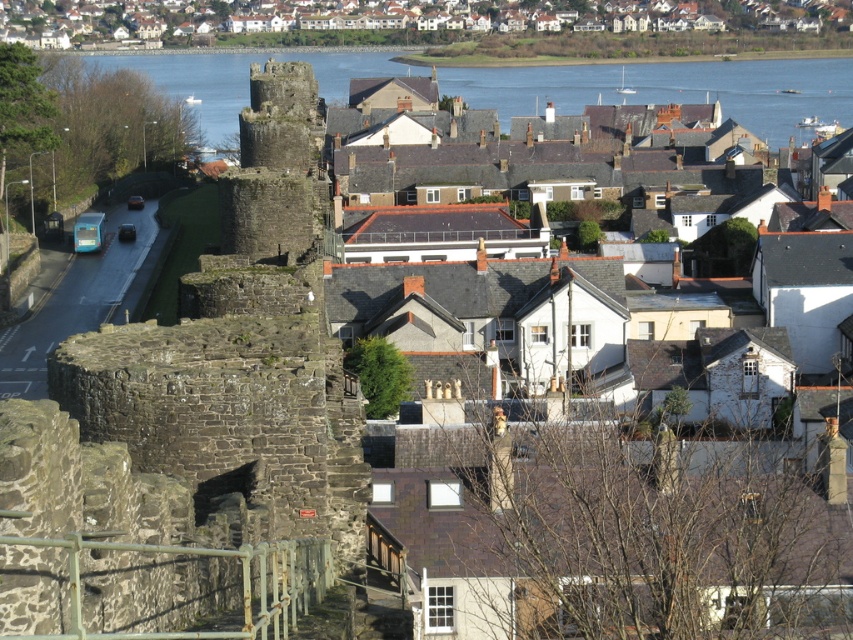
Can you confirm if rusty stone castle at center is taller than clear blue water at upper center?

No.

Who is more forward, (286, 513) or (827, 83)?

Point (286, 513)

Who is more forward, (224, 177) or (537, 81)?

Positioned in front is point (224, 177).

The image size is (853, 640). I want to click on rusty stone castle at center, so click(202, 388).

Can you confirm if clear blue water at upper center is wider than blue concrete road at left?

Correct, the width of clear blue water at upper center exceeds that of blue concrete road at left.

Is point (496, 81) closer to camera compared to point (134, 252)?

No, it is not.

The height and width of the screenshot is (640, 853). I want to click on clear blue water at upper center, so pos(670,90).

Between rusty stone castle at center and blue concrete road at left, which one is positioned lower?

blue concrete road at left is lower down.

Describe the element at coordinates (202, 388) in the screenshot. I see `rusty stone castle at center` at that location.

Describe the element at coordinates (202, 388) in the screenshot. I see `rusty stone castle at center` at that location.

Where is `rusty stone castle at center`? rusty stone castle at center is located at coordinates (202, 388).